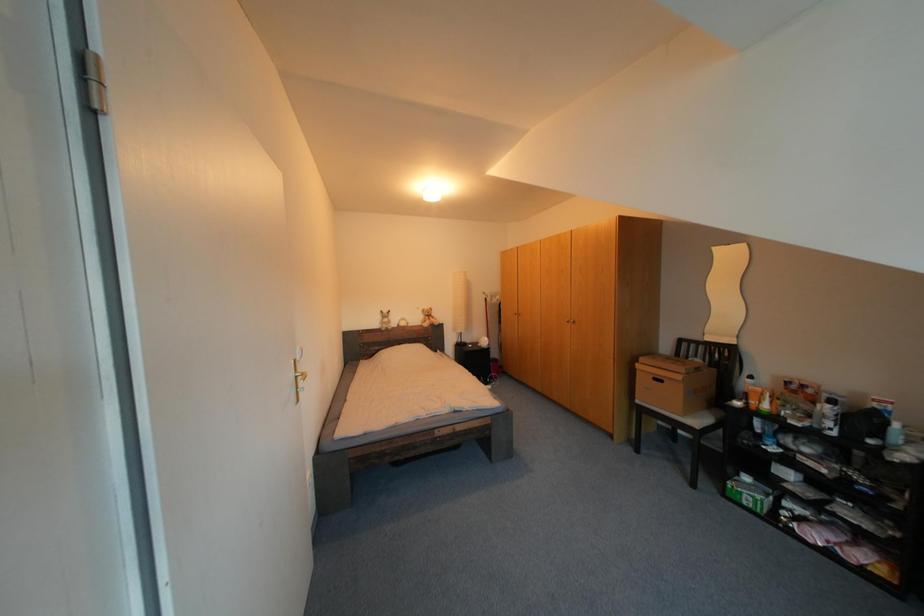
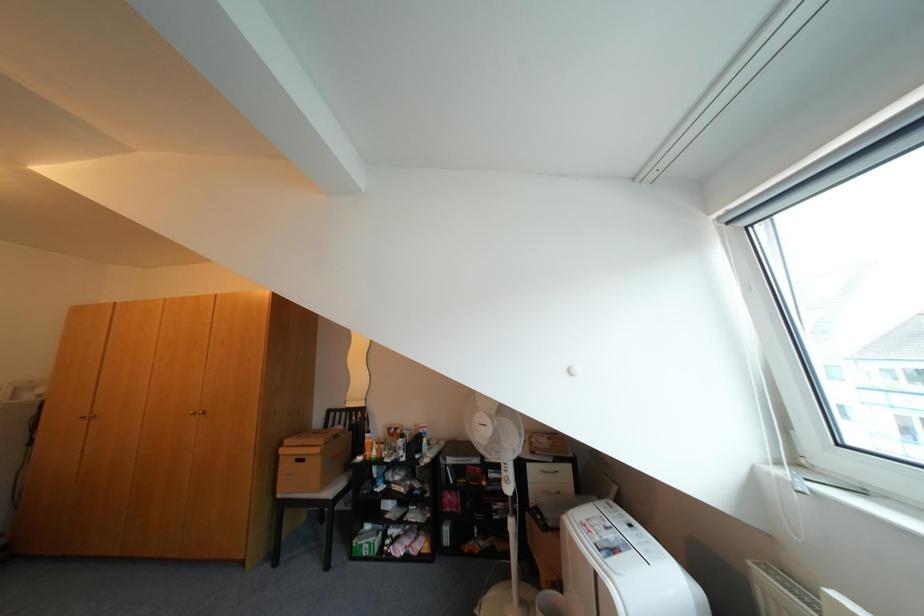
Question: The camera is either moving clockwise (left) or counter-clockwise (right) around the object. The first image is from the beginning of the video and the second image is from the end. Is the camera moving left or right when shooting the video?

Choices:
 (A) Left
 (B) Right

Answer: (A)